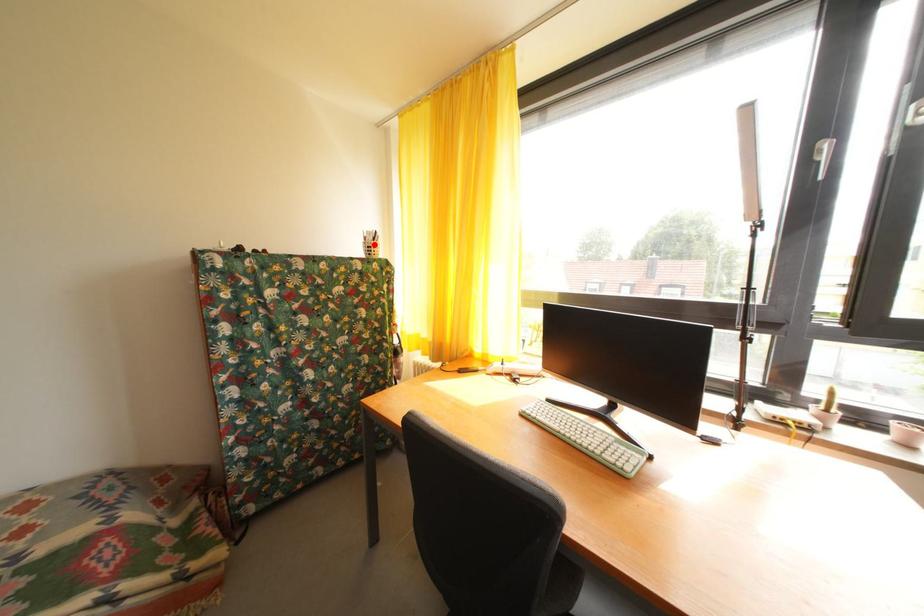
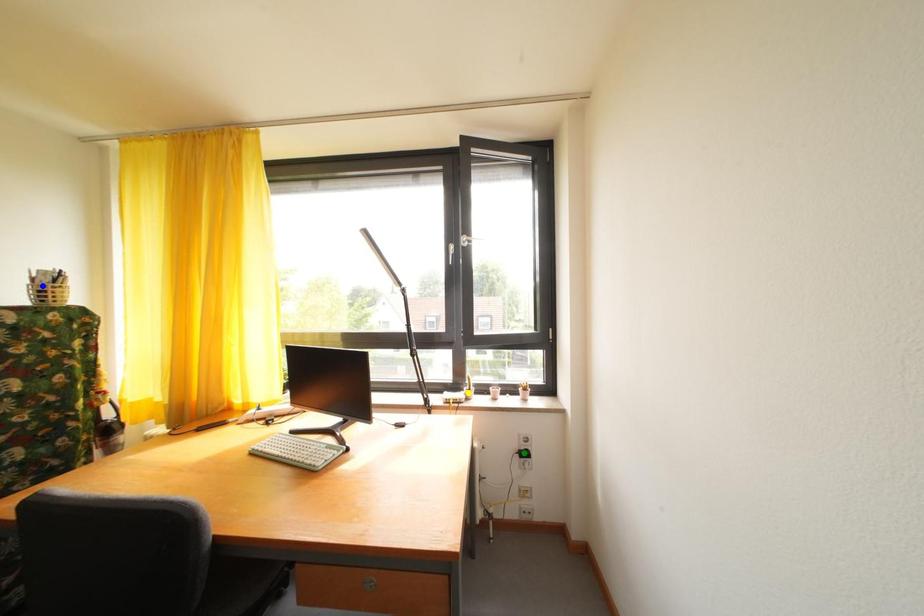
Question: I am providing you with two images of the same scene from different viewpoints. A red point is marked on the first image. You are given multiple points on the second image. Can you choose the point in image 2 that corresponds to the point in image 1?

Choices:
 (A) yellow point
 (B) blue point
 (C) green point

Answer: (B)